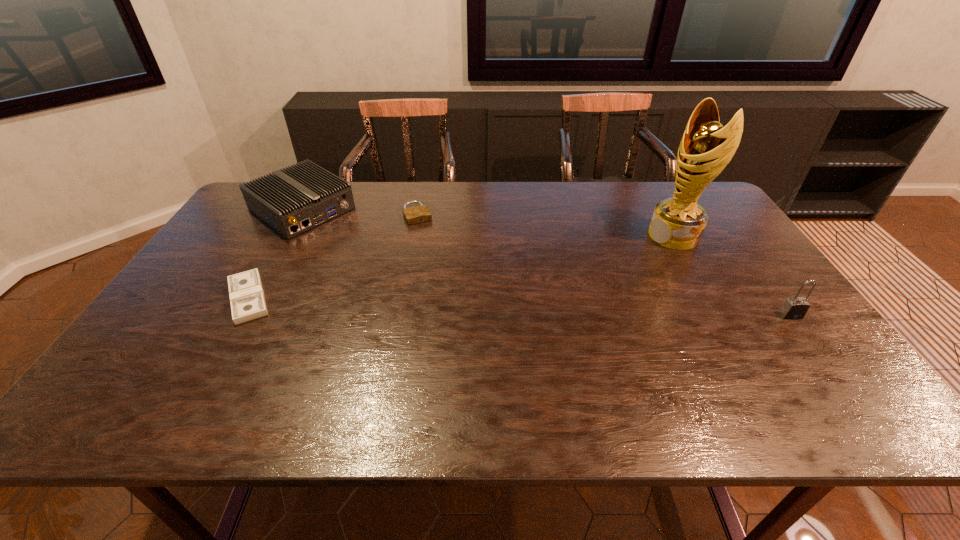
At what (x,y) coordinates should I click in order to perform the action: click on vacant space at the far right corner. Please return your answer as a coordinate pair (x, y). Looking at the image, I should click on (717, 213).

Where is `empty space between the left padlock and the right padlock`? The width and height of the screenshot is (960, 540). empty space between the left padlock and the right padlock is located at coordinates (604, 265).

Identify the location of free area in between the award and the shortest object. (461, 267).

Locate an element on the screen. unoccupied position between the dollar and the right padlock is located at coordinates (519, 306).

Locate an element on the screen. The height and width of the screenshot is (540, 960). vacant area that lies between the shortest object and the third tallest object is located at coordinates (276, 253).

At what (x,y) coordinates should I click in order to perform the action: click on free spot between the fourth shortest object and the shorter padlock. Please return your answer as a coordinate pair (x, y). This screenshot has width=960, height=540. Looking at the image, I should click on (604, 265).

The height and width of the screenshot is (540, 960). Identify the location of vacant space in between the second tallest object and the award. (732, 275).

The width and height of the screenshot is (960, 540). Find the location of `free spot between the shortest object and the left padlock`. free spot between the shortest object and the left padlock is located at coordinates (333, 256).

This screenshot has height=540, width=960. In order to click on free space that is in between the nearer padlock and the tallest object in this screenshot , I will do `click(732, 275)`.

Where is `vacant space in between the router and the award`? Image resolution: width=960 pixels, height=540 pixels. vacant space in between the router and the award is located at coordinates (488, 222).